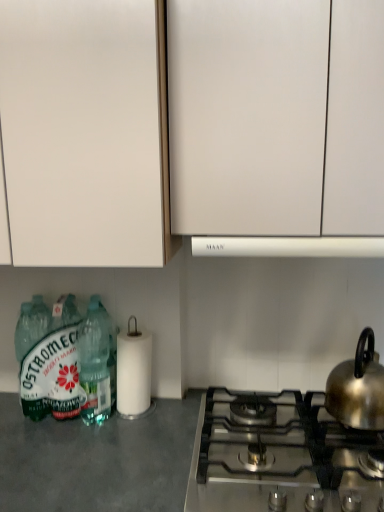
Identify the location of free location above gray matte countertop at lower left (from a real-world perspective). This screenshot has height=512, width=384. (80, 437).